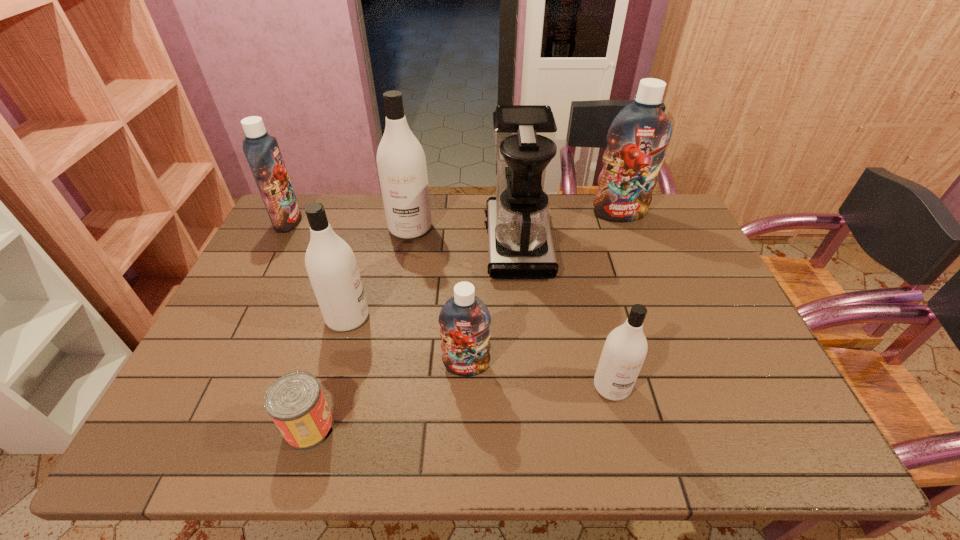
Where is `vacant space at the far edge of the desktop`? vacant space at the far edge of the desktop is located at coordinates (376, 215).

Locate an element on the screen. The image size is (960, 540). vacant space at the near edge is located at coordinates (414, 418).

In order to click on vacant space at the left edge in this screenshot , I will do `click(294, 286)`.

Where is `free space at the right edge of the desktop`? Image resolution: width=960 pixels, height=540 pixels. free space at the right edge of the desktop is located at coordinates (764, 374).

At what (x,y) coordinates should I click in order to perform the action: click on vacant point at the far left corner. Please return your answer as a coordinate pair (x, y). This screenshot has width=960, height=540. Looking at the image, I should click on tap(324, 203).

You are a GUI agent. You are given a task and a screenshot of the screen. Output one action in this format:
    pyautogui.click(x=<x>, y=<y>)
    Task: Click on the free space between the leftmost shampoo and the nearest blue shampoo
    
    Given the screenshot: What is the action you would take?
    pyautogui.click(x=377, y=294)

What are the coordinates of `free space between the second blue shampoo from right to left and the second object from right to left` in the screenshot? It's located at (540, 376).

What are the coordinates of `free point between the can and the rightmost white shampoo` in the screenshot? It's located at (461, 407).

Identify the location of vacant area that lies between the coffee maker and the seventh object from left to right. This screenshot has height=540, width=960. pos(564,315).

You are a GUI agent. You are given a task and a screenshot of the screen. Output one action in this format:
    pyautogui.click(x=<x>, y=<y>)
    Task: Click on the free point between the second smallest blue shampoo and the farthest white shampoo
    
    Given the screenshot: What is the action you would take?
    pyautogui.click(x=349, y=225)